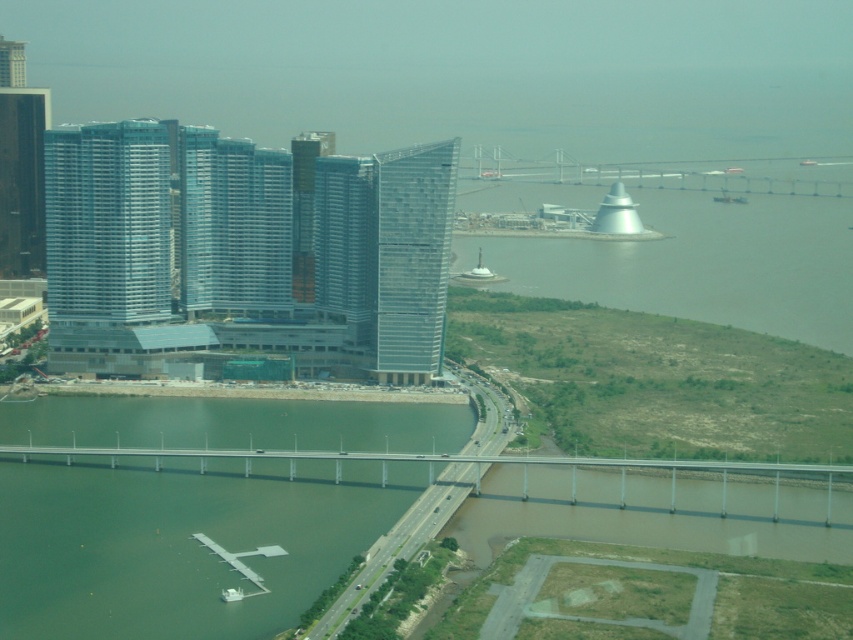
You are a drone operator who needs to fly a drone from the concrete bridge at center to the white metallic bridge at upper center. Based on the scene, which bridge is closer to you, and why?

→ The concrete bridge at center is closer to you because it is positioned in front of the white metallic bridge at upper center, meaning the white metallic bridge is further away.

You are a city planner analyzing traffic flow. You observe the green concrete bridge at lower left and the concrete bridge at center. Which bridge has a greater capacity for vehicles based on their widths?

The concrete bridge at center has a greater capacity for vehicles because its width is greater than the green concrete bridge at lower left.